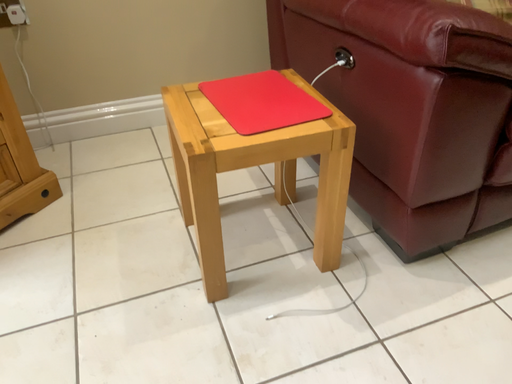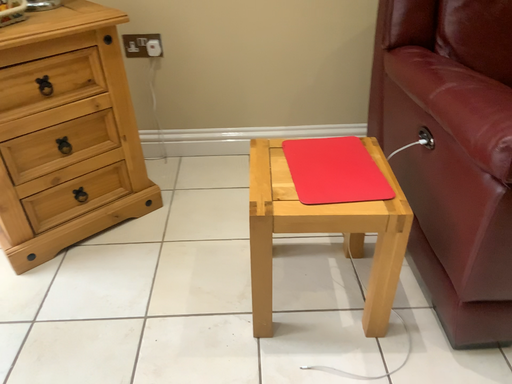
Question: Which way did the camera rotate in the video?

Choices:
 (A) rotated left
 (B) rotated right

Answer: (A)